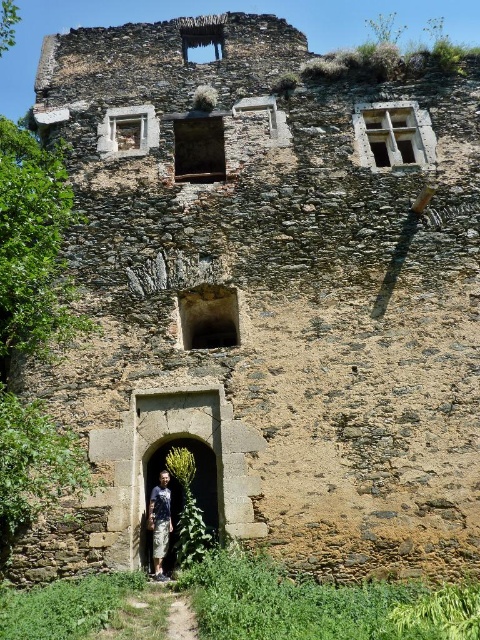
Is camouflage pants at center closer to the viewer compared to dirt/gravel path at center?

No, camouflage pants at center is further to the viewer.

Which is more to the left, camouflage pants at center or dirt/gravel path at center?

camouflage pants at center is more to the left.

Is point (156, 552) less distant than point (168, 624)?

No.

Identify the location of camouflage pants at center. (159, 522).